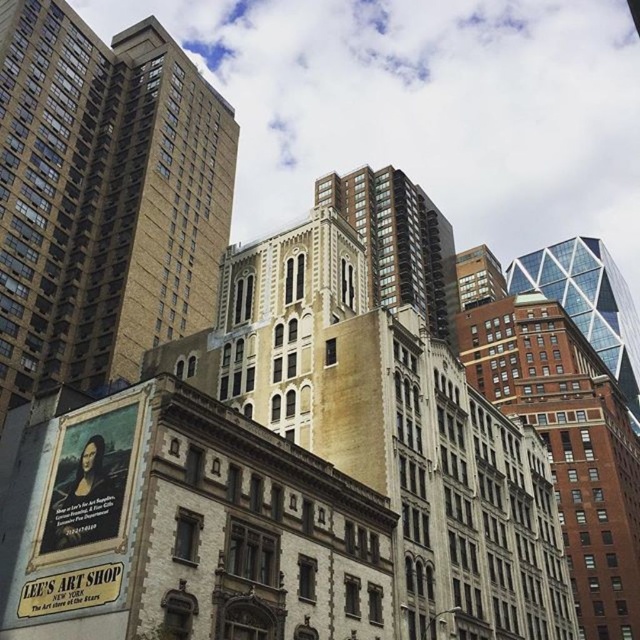
Question: Estimate the real-world distances between objects in this image. Which object is farther from the beige stone building at left?

Choices:
 (A) gold brick building at center
 (B) brown brick building at center-right

Answer: (B)

Question: Which point is farther from the camera taking this photo?

Choices:
 (A) (634, 522)
 (B) (317, 193)
 (C) (608, 289)

Answer: (C)

Question: Is brown brick building at center-right smaller than glassy steel skyscraper at upper right?

Choices:
 (A) no
 (B) yes

Answer: (B)

Question: Among these points, which one is nearest to the camera?

Choices:
 (A) (624, 288)
 (B) (189, 115)

Answer: (B)

Question: Does brown brick building at center-right appear over glassy steel skyscraper at upper right?

Choices:
 (A) no
 (B) yes

Answer: (A)

Question: Does beige stone building at left appear on the right side of brown brick building at center-right?

Choices:
 (A) yes
 (B) no

Answer: (B)